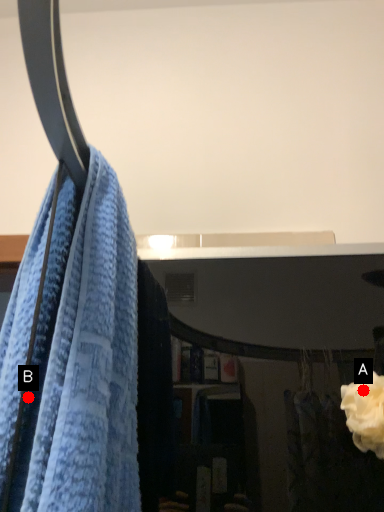
Question: Two points are circled on the image, labeled by A and B beside each circle. Which of the following is the farthest from the observer?

Choices:
 (A) A is further
 (B) B is further

Answer: (A)